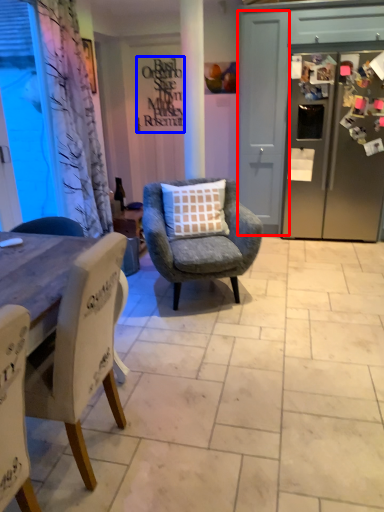
Question: Which of the following is the farthest to the observer, screen door (highlighted by a red box) or writing (highlighted by a blue box)?

Choices:
 (A) screen door
 (B) writing

Answer: (B)